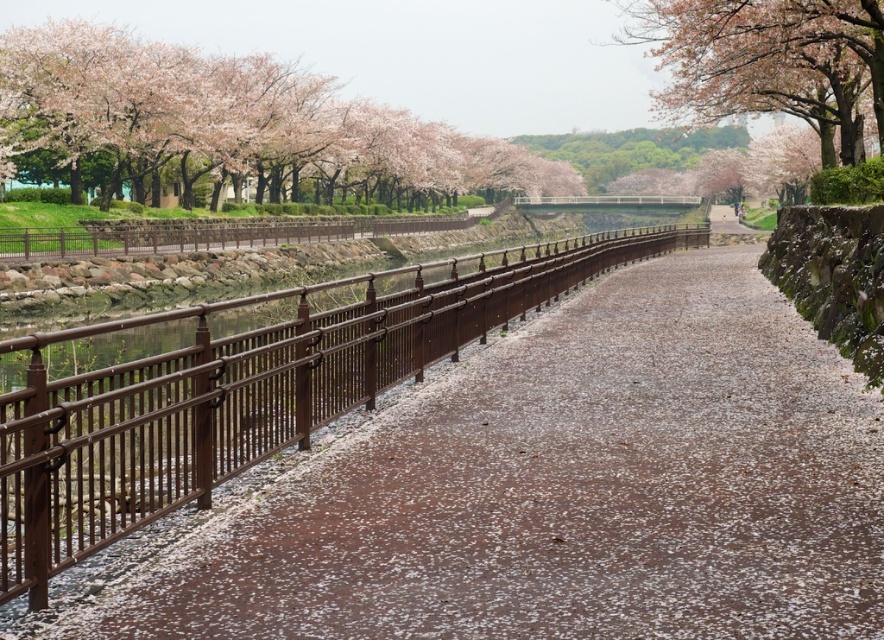
Looking at this image, you are walking along the cherry blossom pathway and notice the brown metallic railing at left and the pink blossoms at upper left. Which object is positioned to the right when viewed from your perspective?

The brown metallic railing at left is positioned to the right of the pink blossoms at upper left.

You are a painter standing on the pathway and want to capture the scene. Which object, the brown metallic railing at left or the pink blossoms at upper left, would appear closer to you in your painting?

The pink blossoms at upper left appear closer because they are larger than the brown metallic railing at left, which is smaller in the scene.